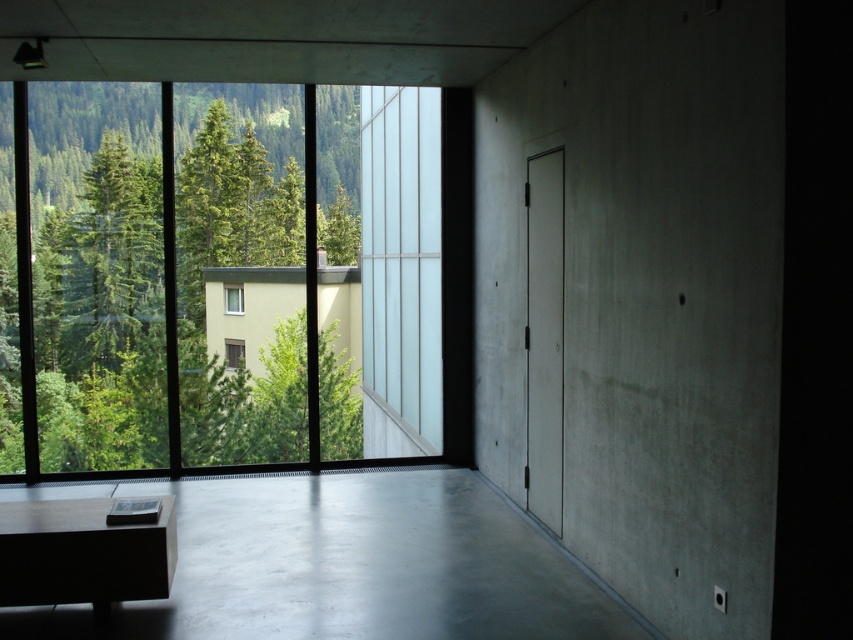
Is the position of green leafy tree at left more distant than that of white plastic window at center?

No.

Who is lower down, green leafy tree at left or white plastic window at center?

Positioned lower is white plastic window at center.

This screenshot has height=640, width=853. Describe the element at coordinates (164, 276) in the screenshot. I see `green leafy tree at left` at that location.

Find the location of a particular element. This screenshot has width=853, height=640. green leafy tree at left is located at coordinates (164, 276).

Is point (479, 614) positioned in front of point (233, 310)?

That is True.

Does smooth concrete table at lower left appear over white plastic window at center?

No.

Does point (135, 628) come in front of point (230, 300)?

Yes, point (135, 628) is closer to viewer.

Where is `smooth concrete table at lower left`? This screenshot has height=640, width=853. smooth concrete table at lower left is located at coordinates (345, 564).

Is clear glass window at center positioned behind white plastic window at center?

No, clear glass window at center is closer to the viewer.

Is clear glass window at center above white plastic window at center?

No.

Is point (229, 339) behind point (242, 300)?

That is False.

Find the location of a particular element. Image resolution: width=853 pixels, height=640 pixels. clear glass window at center is located at coordinates (234, 353).